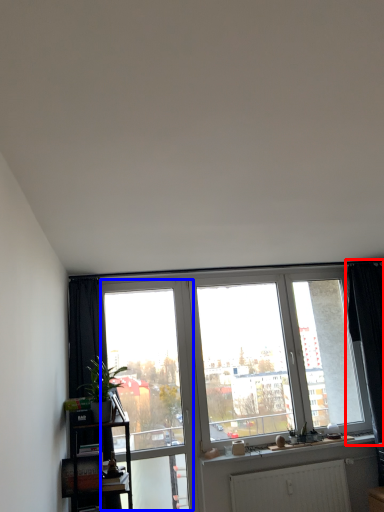
Question: Which of the following is the closest to the observer, curtain (highlighted by a red box) or screen door (highlighted by a blue box)?

Choices:
 (A) curtain
 (B) screen door

Answer: (B)